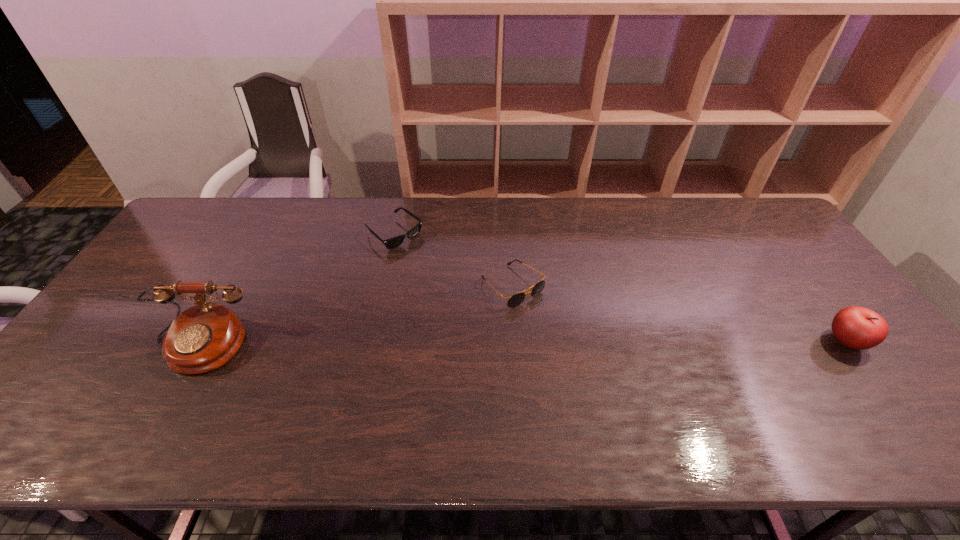
Identify the location of the leftmost object. (204, 337).

Where is `the tallest object`? the tallest object is located at coordinates (204, 337).

Locate an element on the screen. the second tallest object is located at coordinates (859, 328).

Find the location of a particular element. This screenshot has height=540, width=960. the rightmost object is located at coordinates point(859,328).

Where is `the left sunglasses`? Image resolution: width=960 pixels, height=540 pixels. the left sunglasses is located at coordinates (391, 243).

You are a GUI agent. You are given a task and a screenshot of the screen. Output one action in this format:
    pyautogui.click(x=<x>, y=<y>)
    Task: Click on the second object from left to right
    The image size is (960, 540).
    Given the screenshot: What is the action you would take?
    pyautogui.click(x=391, y=243)

You are a GUI agent. You are given a task and a screenshot of the screen. Output one action in this format:
    pyautogui.click(x=<x>, y=<y>)
    Task: Click on the right sunglasses
    This screenshot has width=960, height=540.
    Given the screenshot: What is the action you would take?
    pyautogui.click(x=516, y=299)

Image resolution: width=960 pixels, height=540 pixels. I want to click on the second object from right to left, so click(x=516, y=299).

I want to click on vacant space located 0.050m on the dial of the telephone, so click(171, 394).

Image resolution: width=960 pixels, height=540 pixels. Identify the location of vacant space located 0.110m on the front of the second tallest object. (889, 397).